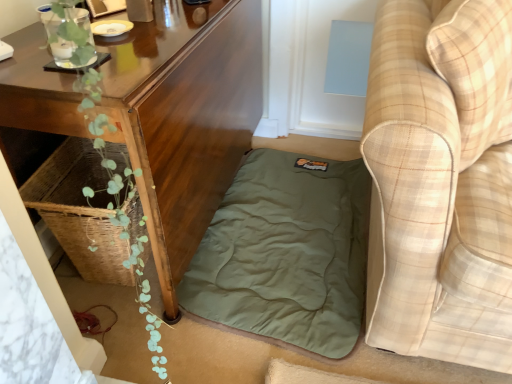
Question: Is olive green fabric mattress at lower center positioned in front of beige plaid fabric couch at lower right?

Choices:
 (A) no
 (B) yes

Answer: (A)

Question: Can you confirm if olive green fabric mattress at lower center is wider than beige plaid fabric couch at lower right?

Choices:
 (A) yes
 (B) no

Answer: (B)

Question: From a real-world perspective, is olive green fabric mattress at lower center located beneath beige plaid fabric couch at lower right?

Choices:
 (A) no
 (B) yes

Answer: (B)

Question: Are olive green fabric mattress at lower center and beige plaid fabric couch at lower right far apart?

Choices:
 (A) no
 (B) yes

Answer: (A)

Question: Is olive green fabric mattress at lower center positioned behind beige plaid fabric couch at lower right?

Choices:
 (A) no
 (B) yes

Answer: (B)

Question: In terms of height, does beige plaid fabric couch at lower right look taller or shorter compared to olive green fabric mattress at lower center?

Choices:
 (A) short
 (B) tall

Answer: (B)

Question: Is beige plaid fabric couch at lower right spatially inside olive green fabric mattress at lower center, or outside of it?

Choices:
 (A) outside
 (B) inside

Answer: (A)

Question: From a real-world perspective, relative to olive green fabric mattress at lower center, is beige plaid fabric couch at lower right vertically above or below?

Choices:
 (A) below
 (B) above

Answer: (B)

Question: Looking at the image, does beige plaid fabric couch at lower right seem bigger or smaller compared to olive green fabric mattress at lower center?

Choices:
 (A) small
 (B) big

Answer: (B)

Question: Would you say wooden table at lower left is inside or outside olive green fabric mattress at lower center?

Choices:
 (A) outside
 (B) inside

Answer: (A)

Question: In terms of height, does wooden table at lower left look taller or shorter compared to olive green fabric mattress at lower center?

Choices:
 (A) tall
 (B) short

Answer: (A)

Question: In the image, is wooden table at lower left positioned in front of or behind olive green fabric mattress at lower center?

Choices:
 (A) behind
 (B) front

Answer: (B)

Question: Considering the relative positions of wooden table at lower left and olive green fabric mattress at lower center in the image provided, is wooden table at lower left to the left or to the right of olive green fabric mattress at lower center?

Choices:
 (A) right
 (B) left

Answer: (B)

Question: Would you say olive green fabric mattress at lower center is inside or outside beige plaid fabric couch at lower right?

Choices:
 (A) outside
 (B) inside

Answer: (A)

Question: From the image's perspective, is olive green fabric mattress at lower center above or below beige plaid fabric couch at lower right?

Choices:
 (A) above
 (B) below

Answer: (B)